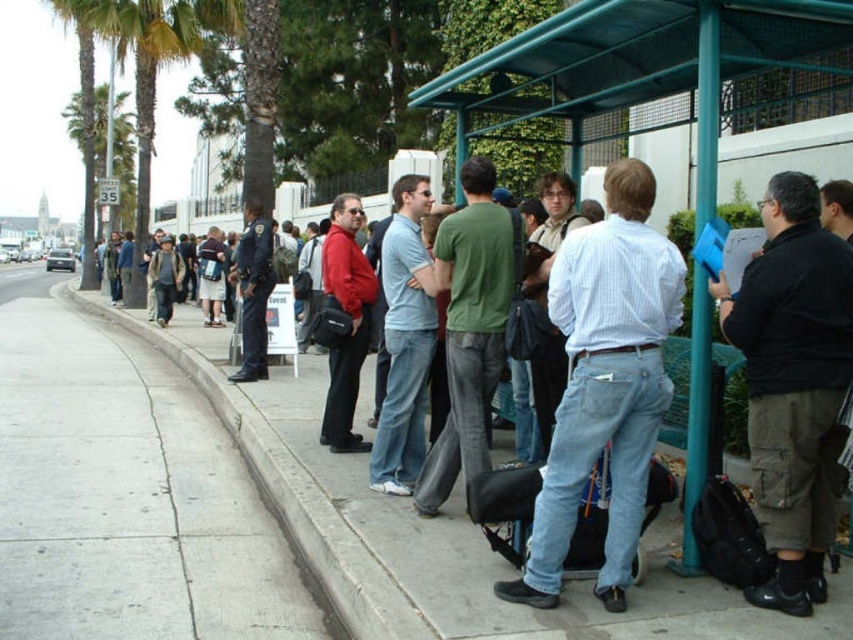
You are a pedestrian standing at the bus stop. You see the green metal bus stop at center and the black cotton shirt at right. Which object is higher from the ground?

The green metal bus stop at center is located above the black cotton shirt at right, so the green metal bus stop at center is higher from the ground.

You are standing at the bus stop and need to locate the green metal bus stop at center. What are its coordinates?

The green metal bus stop at center is located at coordinates point (639, 65).

You are standing at the bus stop and want to hand a pamphlet to the person wearing the black cotton shirt at right. If your arm can reach 1.5 meters, can you reach them without moving?

The distance between you and the black cotton shirt at right is 3.84 meters, which is farther than your arm can reach. You would need to move closer to hand the pamphlet.